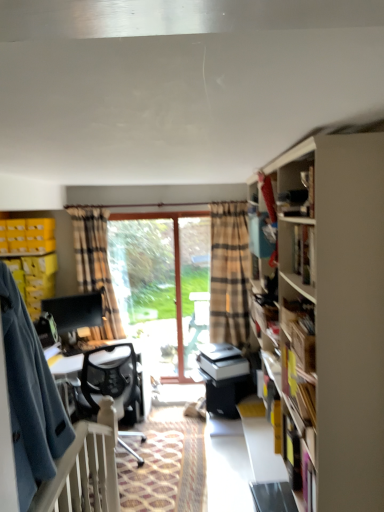
Where is `transparent glass screen door at center`? The width and height of the screenshot is (384, 512). transparent glass screen door at center is located at coordinates (194, 288).

Looking at this image, measure the distance between point (48, 252) and camera.

Point (48, 252) and camera are 4.54 meters apart.

Identify the location of white mesh chair at center. (107, 377).

Based on the photo, does white mesh chair at center have a greater width compared to transparent glass door at center?

Indeed, white mesh chair at center has a greater width compared to transparent glass door at center.

Are white mesh chair at center and transparent glass door at center making contact?

No, white mesh chair at center is not next to transparent glass door at center.

Is white mesh chair at center facing away from transparent glass door at center?

white mesh chair at center does not have its back to transparent glass door at center.

Can you confirm if white mesh chair at center is shorter than transparent glass door at center?

Correct, white mesh chair at center is not as tall as transparent glass door at center.

From the image's perspective, between yellow plastic crate at left, the second cabinet ordered from the bottom, and matte black bookshelf at upper right, who is located below?

yellow plastic crate at left, the second cabinet ordered from the bottom.

In the scene shown: Does yellow plastic crate at left, the second cabinet ordered from the bottom, turn towards matte black bookshelf at upper right?

No, yellow plastic crate at left, the second cabinet ordered from the bottom, does not turn towards matte black bookshelf at upper right.

Is yellow plastic crate at left, the second cabinet ordered from the bottom, thinner than matte black bookshelf at upper right?

No, yellow plastic crate at left, the second cabinet ordered from the bottom, is not thinner than matte black bookshelf at upper right.

Is point (52, 231) farther from camera compared to point (312, 170)?

Yes, it is behind point (312, 170).

Is yellow plastic crate at left, the second cabinet ordered from the bottom, positioned beyond the bounds of white plastic balustrade at lower left?

Yes, yellow plastic crate at left, the second cabinet ordered from the bottom, is not within white plastic balustrade at lower left.

Is yellow plastic crate at left, the second cabinet ordered from the bottom, facing away from white plastic balustrade at lower left?

yellow plastic crate at left, the second cabinet ordered from the bottom, is not turned away from white plastic balustrade at lower left.

From a real-world perspective, who is located lower, yellow plastic crate at left, the second cabinet ordered from the bottom, or white plastic balustrade at lower left?

white plastic balustrade at lower left, from a real-world perspective.

Considering the sizes of objects yellow plastic crate at left, the second cabinet ordered from the bottom, and white plastic balustrade at lower left in the image provided, who is thinner, yellow plastic crate at left, the second cabinet ordered from the bottom, or white plastic balustrade at lower left?

white plastic balustrade at lower left.

From the image's perspective, relative to yellow plastic crate at left, the second cabinet ordered from the bottom, is matte black cabinet at left, which ranks as the first cabinet in bottom-to-top order, above or below?

From the image's perspective, matte black cabinet at left, which ranks as the first cabinet in bottom-to-top order, appears below yellow plastic crate at left, the second cabinet ordered from the bottom.

The width and height of the screenshot is (384, 512). Find the location of `cabinet on the right of yellow plastic crate at left, the second cabinet ordered from the bottom`. cabinet on the right of yellow plastic crate at left, the second cabinet ordered from the bottom is located at coordinates (32, 258).

Could you measure the distance between matte black cabinet at left, which ranks as the first cabinet in bottom-to-top order, and yellow plastic crate at left, the second cabinet ordered from the bottom?

3.95 inches.

Considering the sizes of matte black cabinet at left, which ranks as the first cabinet in bottom-to-top order, and yellow plastic crate at left, which ranks as the first cabinet in top-to-bottom order, in the image, is matte black cabinet at left, which ranks as the first cabinet in bottom-to-top order, wider or thinner than yellow plastic crate at left, which ranks as the first cabinet in top-to-bottom order,?

Clearly, matte black cabinet at left, which ranks as the first cabinet in bottom-to-top order, has more width compared to yellow plastic crate at left, which ranks as the first cabinet in top-to-bottom order.

Is transparent glass door at center in front of white mesh chair at center?

No, it is not.

Does transparent glass door at center have a larger size compared to white mesh chair at center?

Actually, transparent glass door at center might be smaller than white mesh chair at center.

From the image's perspective, is transparent glass door at center positioned above or below white mesh chair at center?

transparent glass door at center is above white mesh chair at center.

Is transparent glass door at center facing away from plaid fabric curtain at center?

No, transparent glass door at center's orientation is not away from plaid fabric curtain at center.

From the image's perspective, relative to plaid fabric curtain at center, is transparent glass door at center above or below?

From the image's perspective, transparent glass door at center appears below plaid fabric curtain at center.

Between transparent glass door at center and plaid fabric curtain at center, which one appears on the left side from the viewer's perspective?

plaid fabric curtain at center.

Is point (110, 240) positioned behind point (123, 331)?

Yes, it is.

From a real-world perspective, does white mesh chair at center stand above yellow plastic crate at left, the second cabinet ordered from the bottom?

No, from a real-world perspective, white mesh chair at center is not over yellow plastic crate at left, the second cabinet ordered from the bottom

Is white mesh chair at center positioned with its back to yellow plastic crate at left, the second cabinet ordered from the bottom?

No, white mesh chair at center is not facing away from yellow plastic crate at left, the second cabinet ordered from the bottom.

Which object is closer to the camera, white mesh chair at center or yellow plastic crate at left, the second cabinet ordered from the bottom?

Positioned in front is white mesh chair at center.

Looking at this image, which of these two, white mesh chair at center or yellow plastic crate at left, which ranks as the first cabinet in top-to-bottom order, stands shorter?

Standing shorter between the two is yellow plastic crate at left, which ranks as the first cabinet in top-to-bottom order.

Locate an element on the screen. Image resolution: width=384 pixels, height=512 pixels. window screen above the white mesh chair at center (from a real-world perspective) is located at coordinates (146, 287).

Locate an element on the screen. The width and height of the screenshot is (384, 512). book lying in front of the yellow plastic crate at left, the second cabinet ordered from the bottom is located at coordinates (296, 188).

From the image, which object appears to be nearer to yellow plastic crate at left, which ranks as the first cabinet in top-to-bottom order, plaid fabric curtain at center or white mesh chair at center?

Based on the image, plaid fabric curtain at center appears to be nearer to yellow plastic crate at left, which ranks as the first cabinet in top-to-bottom order.

Based on their spatial positions, is white plastic balustrade at lower left or yellow plastic crate at left, which ranks as the first cabinet in top-to-bottom order, further from transparent glass screen door at center?

Based on the image, white plastic balustrade at lower left appears to be further to transparent glass screen door at center.

Considering their positions, is matte black bookshelf at upper right positioned closer to matte black cabinet at left, the second cabinet in the top-to-bottom sequence, than yellow plastic crate at left, the second cabinet ordered from the bottom?

The object closer to matte black cabinet at left, the second cabinet in the top-to-bottom sequence, is yellow plastic crate at left, the second cabinet ordered from the bottom.

From the image, which object appears to be nearer to matte black cabinet at left, the second cabinet in the top-to-bottom sequence, white plastic balustrade at lower left or white mesh chair at center?

white mesh chair at center is closer to matte black cabinet at left, the second cabinet in the top-to-bottom sequence.

Based on their spatial positions, is matte black cabinet at left, the second cabinet in the top-to-bottom sequence, or yellow plastic crate at left, which ranks as the first cabinet in top-to-bottom order, further from white mesh chair at center?

The object further to white mesh chair at center is yellow plastic crate at left, which ranks as the first cabinet in top-to-bottom order.

From the picture: Based on their spatial positions, is white mesh chair at center or plaid fabric curtain at center further from yellow plastic crate at left, which ranks as the first cabinet in top-to-bottom order?

white mesh chair at center lies further to yellow plastic crate at left, which ranks as the first cabinet in top-to-bottom order, than the other object.

Looking at the image, which one is located further to yellow plastic crate at left, which ranks as the first cabinet in top-to-bottom order, matte black cabinet at left, the second cabinet in the top-to-bottom sequence, or matte black bookshelf at upper right?

Among the two, matte black bookshelf at upper right is located further to yellow plastic crate at left, which ranks as the first cabinet in top-to-bottom order.

Looking at the image, which one is located closer to plaid fabric curtain at center, yellow plastic crate at left, which ranks as the first cabinet in top-to-bottom order, or transparent glass screen door at center?

Among the two, yellow plastic crate at left, which ranks as the first cabinet in top-to-bottom order, is located nearer to plaid fabric curtain at center.

The height and width of the screenshot is (512, 384). Find the location of `chair between white plastic balustrade at lower left and yellow plastic crate at left, which ranks as the first cabinet in top-to-bottom order, in the front-back direction`. chair between white plastic balustrade at lower left and yellow plastic crate at left, which ranks as the first cabinet in top-to-bottom order, in the front-back direction is located at coordinates (107, 377).

At what (x,y) coordinates should I click in order to perform the action: click on curtain positioned between white mesh chair at center and transparent glass screen door at center from near to far. Please return your answer as a coordinate pair (x, y). Looking at the image, I should click on (95, 266).

What are the coordinates of `curtain situated between yellow plastic crate at left, which ranks as the first cabinet in top-to-bottom order, and matte black bookshelf at upper right from left to right` in the screenshot? It's located at (95, 266).

I want to click on curtain between matte black cabinet at left, which ranks as the first cabinet in bottom-to-top order, and transparent glass screen door at center, so click(95, 266).